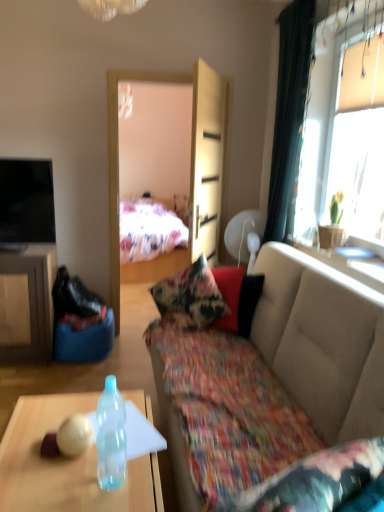
Where is `free spot above transparent plastic bottle at lower left (from a real-world perspective)`? free spot above transparent plastic bottle at lower left (from a real-world perspective) is located at coordinates (69, 456).